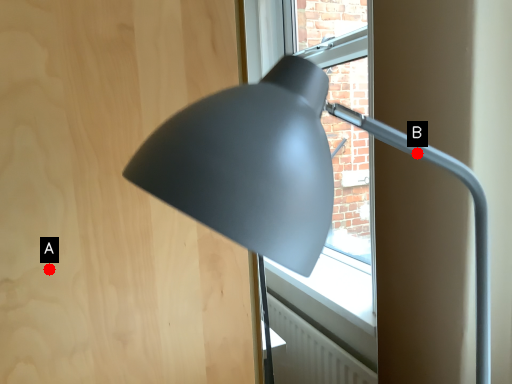
Question: Two points are circled on the image, labeled by A and B beside each circle. Which of the following is the farthest from the observer?

Choices:
 (A) A is further
 (B) B is further

Answer: (A)